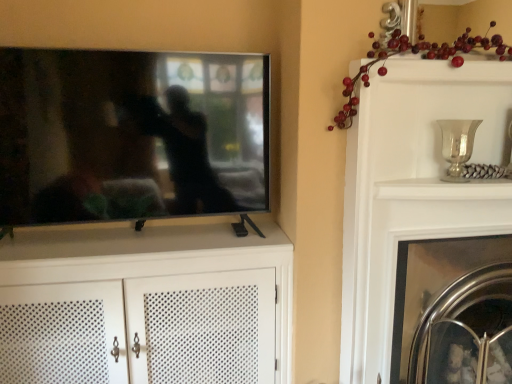
What do you see at coordinates (414, 53) in the screenshot? I see `glossy red berries at upper right` at bounding box center [414, 53].

Where is `polished chrome fireplace at right`? This screenshot has width=512, height=384. polished chrome fireplace at right is located at coordinates (433, 282).

Identify the location of silver metallic vase at upper right. (457, 146).

The width and height of the screenshot is (512, 384). What are the coordinates of `flat screen tv at left` in the screenshot? It's located at (131, 135).

From the image's perspective, does polished chrome fireplace at right appear lower than glossy red berries at upper right?

Correct, polished chrome fireplace at right appears lower than glossy red berries at upper right in the image.

Do you think polished chrome fireplace at right is within glossy red berries at upper right, or outside of it?

polished chrome fireplace at right is not enclosed by glossy red berries at upper right.

Is polished chrome fireplace at right not close to glossy red berries at upper right?

No.

From a real-world perspective, which is physically below, polished chrome fireplace at right or glossy red berries at upper right?

polished chrome fireplace at right is physically lower.

From the picture: Between clear glass fireplace screen at center-right and white perforated cabinet at center, which one is positioned behind?

clear glass fireplace screen at center-right is further from the camera.

Is clear glass fireplace screen at center-right to the right of white perforated cabinet at center from the viewer's perspective?

Indeed, clear glass fireplace screen at center-right is positioned on the right side of white perforated cabinet at center.

Is clear glass fireplace screen at center-right far from white perforated cabinet at center?

clear glass fireplace screen at center-right is actually quite close to white perforated cabinet at center.

Considering the relative sizes of clear glass fireplace screen at center-right and white perforated cabinet at center in the image provided, is clear glass fireplace screen at center-right shorter than white perforated cabinet at center?

Yes.

Between polished chrome fireplace at right and clear glass fireplace screen at center-right, which one is positioned behind?

polished chrome fireplace at right is further away from the camera.

Could you tell me if polished chrome fireplace at right is facing clear glass fireplace screen at center-right?

Yes, polished chrome fireplace at right is facing clear glass fireplace screen at center-right.

Is polished chrome fireplace at right surrounding clear glass fireplace screen at center-right?

Definitely not — clear glass fireplace screen at center-right is not inside polished chrome fireplace at right.

Based on the photo, considering the sizes of objects clear glass fireplace screen at center-right and flat screen tv at left in the image provided, who is smaller, clear glass fireplace screen at center-right or flat screen tv at left?

clear glass fireplace screen at center-right.

Is clear glass fireplace screen at center-right shorter than flat screen tv at left?

Correct, clear glass fireplace screen at center-right is not as tall as flat screen tv at left.

Is clear glass fireplace screen at center-right looking in the opposite direction of flat screen tv at left?

clear glass fireplace screen at center-right does not have its back to flat screen tv at left.

Image resolution: width=512 pixels, height=384 pixels. In order to click on glass door on the right of flat screen tv at left in this screenshot , I will do `click(467, 355)`.

From the picture: Does silver metallic vase at upper right appear on the right side of glossy red berries at upper right?

Indeed, silver metallic vase at upper right is positioned on the right side of glossy red berries at upper right.

Does silver metallic vase at upper right touch glossy red berries at upper right?

silver metallic vase at upper right and glossy red berries at upper right are not in contact.

Is silver metallic vase at upper right taller than glossy red berries at upper right?

In fact, silver metallic vase at upper right may be shorter than glossy red berries at upper right.

Is silver metallic vase at upper right closer to the viewer compared to glossy red berries at upper right?

No.

In terms of height, does silver metallic vase at upper right look taller or shorter compared to flat screen tv at left?

In the image, silver metallic vase at upper right appears to be shorter than flat screen tv at left.

Is silver metallic vase at upper right aimed at flat screen tv at left?

No.

Is silver metallic vase at upper right at the right side of flat screen tv at left?

Indeed, silver metallic vase at upper right is positioned on the right side of flat screen tv at left.

From a real-world perspective, who is located higher, silver metallic vase at upper right or flat screen tv at left?

flat screen tv at left, from a real-world perspective.

Which of these two, clear glass fireplace screen at center-right or silver metallic vase at upper right, stands taller?

clear glass fireplace screen at center-right.

Image resolution: width=512 pixels, height=384 pixels. In order to click on candle holder lying on the left of clear glass fireplace screen at center-right in this screenshot , I will do `click(457, 146)`.

Does clear glass fireplace screen at center-right have a smaller size compared to silver metallic vase at upper right?

No, clear glass fireplace screen at center-right is not smaller than silver metallic vase at upper right.

Is clear glass fireplace screen at center-right positioned in front of silver metallic vase at upper right?

No, clear glass fireplace screen at center-right is further to the viewer.

Identify the location of fireplace lying behind the glossy red berries at upper right. The width and height of the screenshot is (512, 384). (433, 282).

This screenshot has width=512, height=384. Identify the location of cabinetry above the clear glass fireplace screen at center-right (from the image's perspective). (146, 306).

When comparing their distances from glossy red berries at upper right, does clear glass fireplace screen at center-right or white perforated cabinet at center seem further?

clear glass fireplace screen at center-right is further to glossy red berries at upper right.

Estimate the real-world distances between objects in this image. Which object is closer to clear glass fireplace screen at center-right, flat screen tv at left or glossy red berries at upper right?

glossy red berries at upper right.

Estimate the real-world distances between objects in this image. Which object is further from glossy red berries at upper right, flat screen tv at left or clear glass fireplace screen at center-right?

clear glass fireplace screen at center-right.

Based on their spatial positions, is white perforated cabinet at center or clear glass fireplace screen at center-right closer to silver metallic vase at upper right?

clear glass fireplace screen at center-right is closer to silver metallic vase at upper right.

Estimate the real-world distances between objects in this image. Which object is closer to silver metallic vase at upper right, clear glass fireplace screen at center-right or polished chrome fireplace at right?

Based on the image, polished chrome fireplace at right appears to be nearer to silver metallic vase at upper right.

Looking at the image, which one is located closer to polished chrome fireplace at right, clear glass fireplace screen at center-right or white perforated cabinet at center?

clear glass fireplace screen at center-right is positioned closer to the anchor polished chrome fireplace at right.

Which object lies further to the anchor point white perforated cabinet at center, clear glass fireplace screen at center-right or flat screen tv at left?

clear glass fireplace screen at center-right lies further to white perforated cabinet at center than the other object.

Considering their positions, is silver metallic vase at upper right positioned closer to clear glass fireplace screen at center-right than polished chrome fireplace at right?

The object closer to clear glass fireplace screen at center-right is polished chrome fireplace at right.

Where is `candle holder between glossy red berries at upper right and polished chrome fireplace at right in the vertical direction`? The height and width of the screenshot is (384, 512). candle holder between glossy red berries at upper right and polished chrome fireplace at right in the vertical direction is located at coordinates (457, 146).

Identify the location of fireplace between glossy red berries at upper right and clear glass fireplace screen at center-right vertically. The width and height of the screenshot is (512, 384). (433, 282).

You are a GUI agent. You are given a task and a screenshot of the screen. Output one action in this format:
    pyautogui.click(x=<x>, y=<y>)
    Task: Click on the candle holder between white perforated cabinet at center and polished chrome fireplace at right from left to right
    The image size is (512, 384).
    Given the screenshot: What is the action you would take?
    pyautogui.click(x=457, y=146)

I want to click on candle holder situated between flat screen tv at left and clear glass fireplace screen at center-right from left to right, so click(457, 146).